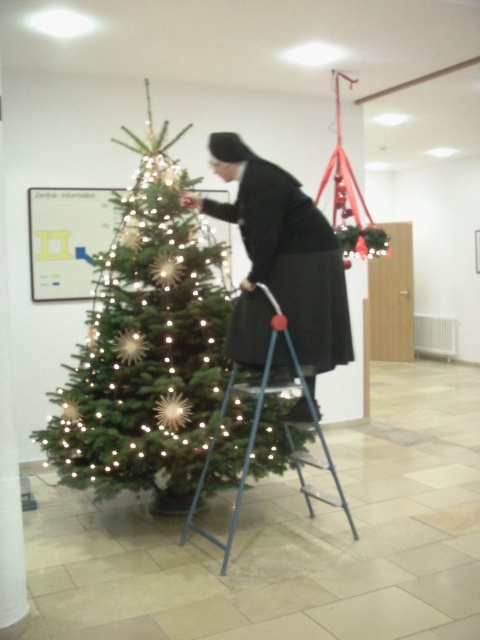
You are a painter needing to reach the top of the green matte christmas tree at center to hang a decoration. You have the blue metallic ladder at center. Can you safely place the ladder under the tree to reach the top?

The green matte christmas tree at center is above the blue metallic ladder at center, which means the ladder is positioned below the tree. Since the ladder is already under the tree, you can safely use it to reach the top.

You are a delivery person who needs to place a large package on the floor near the green matte christmas tree at center and the black matte dress at center. Since the floor space is limited, which object should you place the package closer to to ensure it doesn

The green matte christmas tree at center is taller than the black matte dress at center, so placing the package closer to the tree would utilize vertical space better, leaving more floor space available.

You are a visitor in the room and want to approach the black matte dress at center without disturbing the person on the blue metallic ladder at center. Which direction should you move from your current position at the door?

Since the black matte dress at center is to the left of the blue metallic ladder at center, you should move to the left side of the ladder to approach the dress without disturbing the person on the ladder.